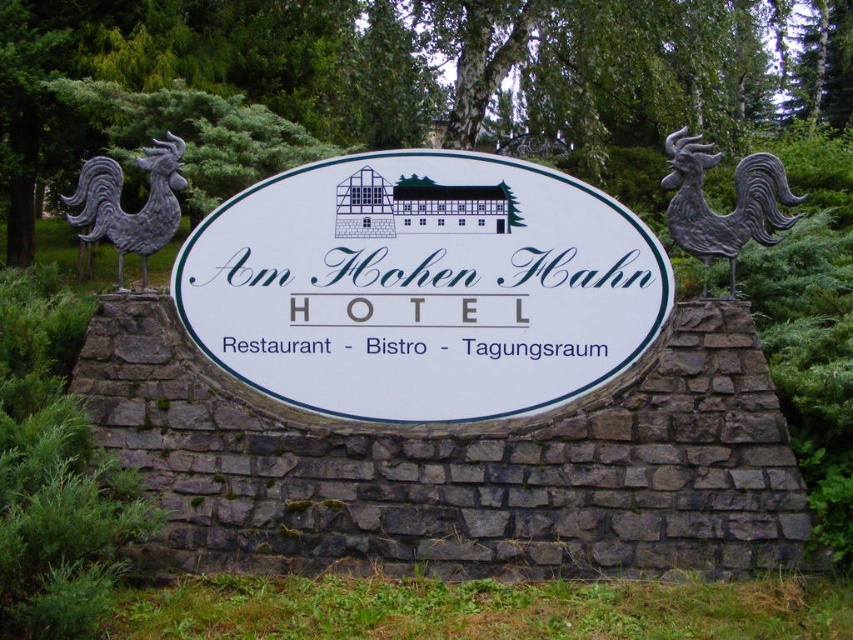
You are a guest approaching the hotel and notice the blue plastic text at center and the blue plastic sign at center on the signboard. Which one is placed higher up on the signboard?

The blue plastic text at center is positioned over the blue plastic sign at center, meaning it is placed higher up on the signboard.

Consider the image. You are designing a poster for the Am Hohen Hahn Hotel and need to include both the white paper sign at center and the blue plastic text at center. Based on the scene description, which object should be placed first in terms of visual prominence to maintain the original layout?

The white paper sign at center is larger in size than the blue plastic text at center, so to maintain the original layout, the white paper sign at center should be placed first in terms of visual prominence.